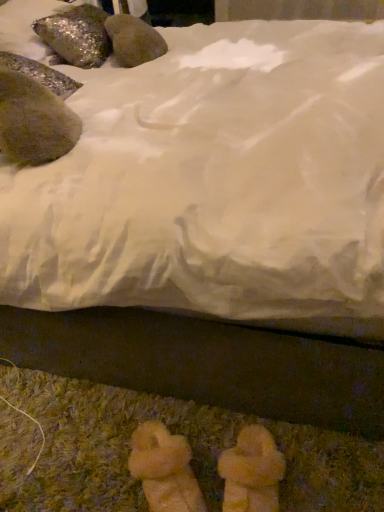
Question: Considering the positions of shiny metallic rock at left, the 2th animal in the top-to-bottom sequence, and shiny metallic rock at upper left, placed as the 2th animal when sorted from bottom to top, in the image, is shiny metallic rock at left, the 2th animal in the top-to-bottom sequence, taller or shorter than shiny metallic rock at upper left, placed as the 2th animal when sorted from bottom to top,?

Choices:
 (A) short
 (B) tall

Answer: (A)

Question: Is shiny metallic rock at left, arranged as the 1th animal when viewed from the front, in front of or behind shiny metallic rock at upper left, positioned as the 1th animal in top-to-bottom order, in the image?

Choices:
 (A) behind
 (B) front

Answer: (B)

Question: In terms of size, does shiny metallic rock at left, arranged as the 1th animal when viewed from the front, appear bigger or smaller than shiny metallic rock at upper left, which is the first animal in back-to-front order?

Choices:
 (A) big
 (B) small

Answer: (B)

Question: From the image's perspective, is shiny metallic rock at upper left, which is the first animal in back-to-front order, positioned above or below shiny metallic rock at left, the 2th animal in the top-to-bottom sequence?

Choices:
 (A) below
 (B) above

Answer: (B)

Question: Would you say shiny metallic rock at upper left, placed as the 2th animal when sorted from bottom to top, is to the left or to the right of shiny metallic rock at left, arranged as the 2th animal when viewed from the back, in the picture?

Choices:
 (A) right
 (B) left

Answer: (B)

Question: Is shiny metallic rock at upper left, marked as the 2th animal in a front-to-back arrangement, taller or shorter than shiny metallic rock at left, arranged as the 1th animal when viewed from the front?

Choices:
 (A) tall
 (B) short

Answer: (A)

Question: From a real-world perspective, is shiny metallic rock at upper left, positioned as the 1th animal in top-to-bottom order, above or below shiny metallic rock at left, arranged as the 1th animal when viewed from the front?

Choices:
 (A) above
 (B) below

Answer: (A)